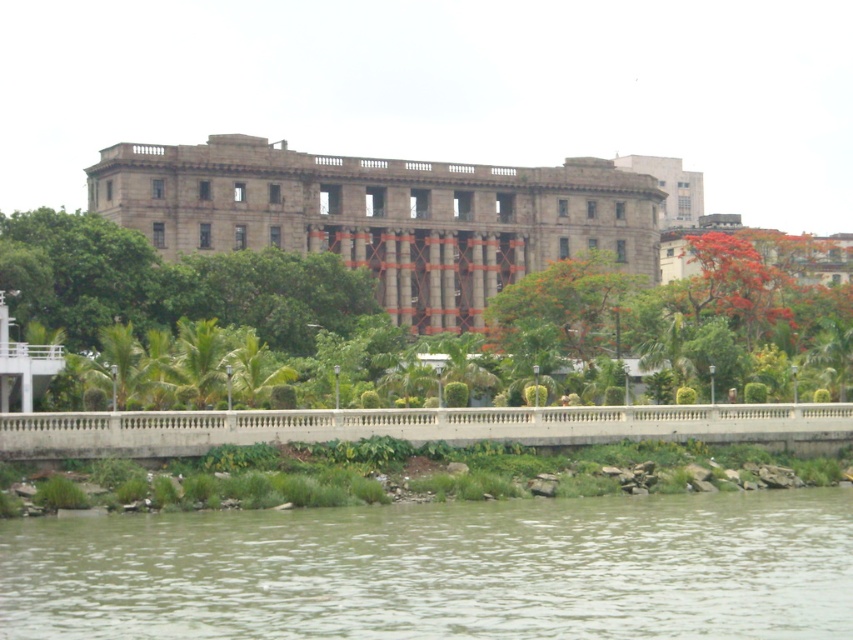
Question: Is brown sedimentary water at lower center below stone building at center?

Choices:
 (A) no
 (B) yes

Answer: (B)

Question: Is brown sedimentary water at lower center thinner than stone building at center?

Choices:
 (A) no
 (B) yes

Answer: (B)

Question: Which of the following is the farthest from the observer?

Choices:
 (A) (700, 556)
 (B) (335, 179)

Answer: (B)

Question: Is brown sedimentary water at lower center to the left of stone building at center from the viewer's perspective?

Choices:
 (A) no
 (B) yes

Answer: (B)